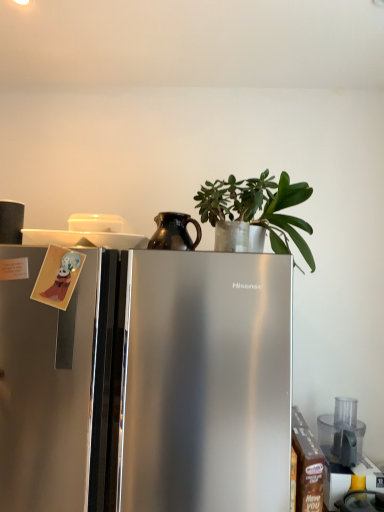
This screenshot has height=512, width=384. In order to click on shiny brown pitcher at center, the first appliance in the front-to-back sequence in this screenshot , I will do `click(174, 232)`.

How different are the orientations of transparent plastic food processor at lower right, marked as the third appliance in a top-to-bottom arrangement, and shiny brown pitcher at center, which ranks as the 2th appliance in left-to-right order, in degrees?

There is a 3.07-degree angle between the facing directions of transparent plastic food processor at lower right, marked as the third appliance in a top-to-bottom arrangement, and shiny brown pitcher at center, which ranks as the 2th appliance in left-to-right order.

Does point (340, 434) come behind point (168, 218)?

Yes, it is.

Who is bigger, transparent plastic food processor at lower right, which is the 1th appliance from right to left, or shiny brown pitcher at center, which ranks as the 2th appliance in left-to-right order?

Bigger between the two is transparent plastic food processor at lower right, which is the 1th appliance from right to left.

From the image's perspective, which is above, transparent plastic food processor at lower right, the third appliance when ordered from left to right, or shiny brown pitcher at center, arranged as the 2th appliance when viewed from the top?

shiny brown pitcher at center, arranged as the 2th appliance when viewed from the top.

Identify the location of refrigerator on the left side of green matte plant at upper center. This screenshot has height=512, width=384. (148, 384).

From a real-world perspective, is satin silver refrigerator at center above or below green matte plant at upper center?

In terms of real-world spatial position, satin silver refrigerator at center is below green matte plant at upper center.

Is satin silver refrigerator at center inside or outside of green matte plant at upper center?

satin silver refrigerator at center cannot be found inside green matte plant at upper center.

Which is in front, matte black coffee cup at upper left, placed as the first appliance when sorted from left to right, or satin silver refrigerator at center?

satin silver refrigerator at center.

Which is behind, point (6, 240) or point (208, 355)?

Positioned behind is point (6, 240).

Based on their positions, is matte black coffee cup at upper left, acting as the second appliance starting from the front, located to the left or right of satin silver refrigerator at center?

In the image, matte black coffee cup at upper left, acting as the second appliance starting from the front, appears on the left side of satin silver refrigerator at center.

Is matte black coffee cup at upper left, placed as the first appliance when sorted from left to right, turned away from satin silver refrigerator at center?

No, matte black coffee cup at upper left, placed as the first appliance when sorted from left to right,'s orientation is not away from satin silver refrigerator at center.

Is green matte plant at upper center to the left of shiny brown pitcher at center, the first appliance in the front-to-back sequence, from the viewer's perspective?

No.

Considering their positions, is green matte plant at upper center located in front of or behind shiny brown pitcher at center, which ranks as the 2th appliance in left-to-right order?

Clearly, green matte plant at upper center is in front of shiny brown pitcher at center, which ranks as the 2th appliance in left-to-right order.

Do you think green matte plant at upper center is within shiny brown pitcher at center, positioned as the second appliance in right-to-left order, or outside of it?

The correct answer is: outside.

Which object is wider, green matte plant at upper center or shiny brown pitcher at center, the first appliance in the front-to-back sequence?

With larger width is green matte plant at upper center.

Is point (360, 428) closer to viewer compared to point (255, 183)?

No, (360, 428) is behind (255, 183).

Considering the relative positions of transparent plastic food processor at lower right, marked as the third appliance in a top-to-bottom arrangement, and green matte plant at upper center in the image provided, is transparent plastic food processor at lower right, marked as the third appliance in a top-to-bottom arrangement, to the left of green matte plant at upper center from the viewer's perspective?

In fact, transparent plastic food processor at lower right, marked as the third appliance in a top-to-bottom arrangement, is to the right of green matte plant at upper center.

Is transparent plastic food processor at lower right, arranged as the first appliance when viewed from the back, bigger than green matte plant at upper center?

No, transparent plastic food processor at lower right, arranged as the first appliance when viewed from the back, is not bigger than green matte plant at upper center.

Which of these two, transparent plastic food processor at lower right, the third appliance viewed from the front, or green matte plant at upper center, is wider?

transparent plastic food processor at lower right, the third appliance viewed from the front, is wider.

Is matte black coffee cup at upper left, which appears as the third appliance when viewed from the right, in contact with green matte plant at upper center?

No, matte black coffee cup at upper left, which appears as the third appliance when viewed from the right, is not in contact with green matte plant at upper center.

Is matte black coffee cup at upper left, the 3th appliance from the bottom, in front of or behind green matte plant at upper center in the image?

Clearly, matte black coffee cup at upper left, the 3th appliance from the bottom, is behind green matte plant at upper center.

This screenshot has width=384, height=512. I want to click on appliance that is the 1st object directly below the green matte plant at upper center (from a real-world perspective), so click(x=11, y=222).

Is green matte plant at upper center in contact with matte black coffee cup at upper left, which is the 2th appliance in back-to-front order?

No, green matte plant at upper center is not making contact with matte black coffee cup at upper left, which is the 2th appliance in back-to-front order.

Which point is more distant from viewer, (277, 207) or (19, 232)?

Positioned behind is point (277, 207).

Which object is further away from the camera taking this photo, green matte plant at upper center or matte black coffee cup at upper left, which appears as the third appliance when viewed from the right?

matte black coffee cup at upper left, which appears as the third appliance when viewed from the right, is further away from the camera.

Can you confirm if green matte plant at upper center is shorter than matte black coffee cup at upper left, acting as the second appliance starting from the front?

No.

Where is `appliance that appears on the right of shiny brown pitcher at center, arranged as the 2th appliance when viewed from the top`? appliance that appears on the right of shiny brown pitcher at center, arranged as the 2th appliance when viewed from the top is located at coordinates (342, 431).

At what (x,y) coordinates should I click in order to perform the action: click on refrigerator on the left of green matte plant at upper center. Please return your answer as a coordinate pair (x, y). Image resolution: width=384 pixels, height=512 pixels. Looking at the image, I should click on (148, 384).

Considering their positions, is shiny brown pitcher at center, which ranks as the 2th appliance in left-to-right order, positioned further to matte black coffee cup at upper left, placed as the first appliance when sorted from left to right, than transparent plastic food processor at lower right, the third appliance viewed from the front?

transparent plastic food processor at lower right, the third appliance viewed from the front.

When comparing their distances from green matte plant at upper center, does matte black coffee cup at upper left, which is the 2th appliance in back-to-front order, or shiny brown pitcher at center, which ranks as the 2th appliance in left-to-right order, seem further?

Among the two, matte black coffee cup at upper left, which is the 2th appliance in back-to-front order, is located further to green matte plant at upper center.

Which object lies further to the anchor point matte black coffee cup at upper left, which appears as the third appliance when viewed from the right, transparent plastic food processor at lower right, the third appliance when ordered from left to right, or shiny brown pitcher at center, the first appliance in the front-to-back sequence?

transparent plastic food processor at lower right, the third appliance when ordered from left to right, is further to matte black coffee cup at upper left, which appears as the third appliance when viewed from the right.

Which object lies further to the anchor point satin silver refrigerator at center, green matte plant at upper center or matte black coffee cup at upper left, which appears as the third appliance when viewed from the right?

matte black coffee cup at upper left, which appears as the third appliance when viewed from the right, is positioned further to the anchor satin silver refrigerator at center.

Estimate the real-world distances between objects in this image. Which object is closer to matte black coffee cup at upper left, acting as the second appliance starting from the front, shiny brown pitcher at center, acting as the 3th appliance starting from the back, or green matte plant at upper center?

shiny brown pitcher at center, acting as the 3th appliance starting from the back, is positioned closer to the anchor matte black coffee cup at upper left, acting as the second appliance starting from the front.

Considering their positions, is transparent plastic food processor at lower right, the third appliance viewed from the front, positioned further to shiny brown pitcher at center, positioned as the second appliance in right-to-left order, than matte black coffee cup at upper left, which is the 2th appliance in back-to-front order?

Among the two, transparent plastic food processor at lower right, the third appliance viewed from the front, is located further to shiny brown pitcher at center, positioned as the second appliance in right-to-left order.

From the image, which object appears to be farther from transparent plastic food processor at lower right, the third appliance when ordered from left to right, green matte plant at upper center or matte black coffee cup at upper left, the 1th appliance viewed from the top?

matte black coffee cup at upper left, the 1th appliance viewed from the top, is positioned further to the anchor transparent plastic food processor at lower right, the third appliance when ordered from left to right.

Estimate the real-world distances between objects in this image. Which object is further from green matte plant at upper center, satin silver refrigerator at center or shiny brown pitcher at center, arranged as the second appliance when ordered from the bottom?

satin silver refrigerator at center lies further to green matte plant at upper center than the other object.

Locate an element on the screen. refrigerator that lies between green matte plant at upper center and transparent plastic food processor at lower right, marked as the 1th appliance in a bottom-to-top arrangement, from top to bottom is located at coordinates (148, 384).

The width and height of the screenshot is (384, 512). What are the coordinates of `appliance between matte black coffee cup at upper left, placed as the first appliance when sorted from left to right, and satin silver refrigerator at center from top to bottom` in the screenshot? It's located at (174, 232).

You are a GUI agent. You are given a task and a screenshot of the screen. Output one action in this format:
    pyautogui.click(x=<x>, y=<y>)
    Task: Click on the appliance located between matte black coffee cup at upper left, which appears as the third appliance when viewed from the right, and transparent plastic food processor at lower right, marked as the 1th appliance in a bottom-to-top arrangement, in the left-right direction
    The image size is (384, 512).
    Given the screenshot: What is the action you would take?
    pyautogui.click(x=174, y=232)

Find the location of a particular element. This screenshot has width=384, height=512. appliance between satin silver refrigerator at center and transparent plastic food processor at lower right, the third appliance when ordered from left to right is located at coordinates (174, 232).